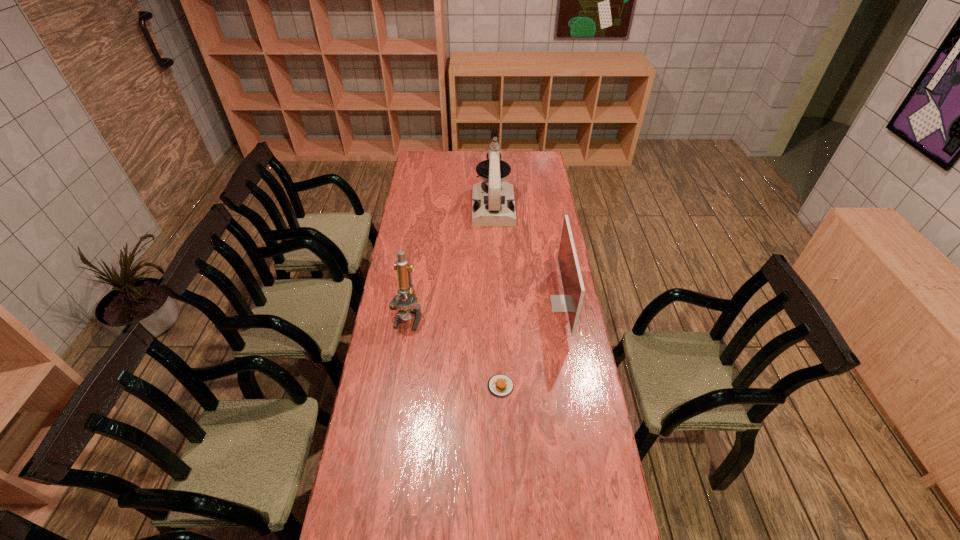
The image size is (960, 540). In order to click on vacant space located on the front-facing side of the monitor in this screenshot , I will do `click(489, 303)`.

Identify the location of blank area located 0.240m on the front-facing side of the monitor. This screenshot has width=960, height=540. (493, 303).

Identify the location of vacant space positioned 0.300m on the left of the shortest object. (402, 386).

Where is `object present at the left edge`? object present at the left edge is located at coordinates (406, 308).

The width and height of the screenshot is (960, 540). Find the location of `object present at the right edge`. object present at the right edge is located at coordinates (572, 283).

The height and width of the screenshot is (540, 960). I want to click on vacant area at the far edge of the desktop, so click(x=471, y=157).

The height and width of the screenshot is (540, 960). In the image, there is a desktop. Identify the location of free space at the left edge. (409, 224).

Locate an element on the screen. free region at the right edge of the desktop is located at coordinates (550, 424).

Locate an element on the screen. Image resolution: width=960 pixels, height=540 pixels. vacant area that lies between the rightmost object and the leftmost object is located at coordinates (486, 310).

You are a GUI agent. You are given a task and a screenshot of the screen. Output one action in this format:
    pyautogui.click(x=<x>, y=<y>)
    Task: Click on the free space between the rightmost object and the leftmost object
    
    Given the screenshot: What is the action you would take?
    pyautogui.click(x=486, y=310)